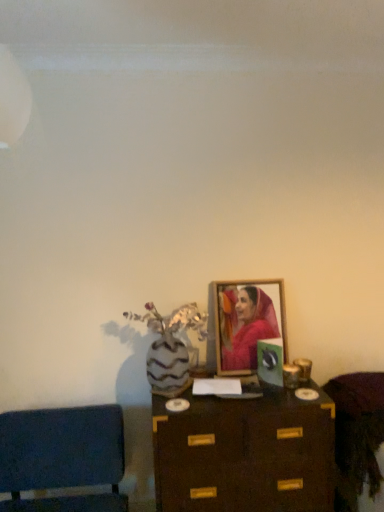
Question: Is wooden cabinet at lower right, the 2th furniture viewed from the left, in front of wooden framed portrait at center?

Choices:
 (A) no
 (B) yes

Answer: (B)

Question: Would you consider wooden cabinet at lower right, the 2th furniture viewed from the left, to be distant from wooden framed portrait at center?

Choices:
 (A) yes
 (B) no

Answer: (B)

Question: Considering the relative positions of wooden cabinet at lower right, the 2th furniture viewed from the left, and wooden framed portrait at center in the image provided, is wooden cabinet at lower right, the 2th furniture viewed from the left, to the left of wooden framed portrait at center from the viewer's perspective?

Choices:
 (A) yes
 (B) no

Answer: (B)

Question: Considering the relative sizes of wooden cabinet at lower right, the 2th furniture viewed from the left, and wooden framed portrait at center in the image provided, is wooden cabinet at lower right, the 2th furniture viewed from the left, taller than wooden framed portrait at center?

Choices:
 (A) yes
 (B) no

Answer: (B)

Question: From the image's perspective, is wooden cabinet at lower right, acting as the 1th furniture starting from the right, beneath wooden framed portrait at center?

Choices:
 (A) no
 (B) yes

Answer: (B)

Question: Is wooden cabinet at lower right, acting as the 1th furniture starting from the right, positioned with its back to wooden framed portrait at center?

Choices:
 (A) yes
 (B) no

Answer: (B)

Question: Does velvet blue cushion at lower left, placed as the 1th furniture when sorted from left to right, come behind wooden framed portrait at center?

Choices:
 (A) no
 (B) yes

Answer: (A)

Question: Is velvet blue cushion at lower left, placed as the 1th furniture when sorted from left to right, positioned with its back to wooden framed portrait at center?

Choices:
 (A) yes
 (B) no

Answer: (B)

Question: From the image's perspective, would you say velvet blue cushion at lower left, the 2th furniture in the right-to-left sequence, is positioned over wooden framed portrait at center?

Choices:
 (A) yes
 (B) no

Answer: (B)

Question: From the image's perspective, is velvet blue cushion at lower left, placed as the 1th furniture when sorted from left to right, below wooden framed portrait at center?

Choices:
 (A) no
 (B) yes

Answer: (B)

Question: Can we say velvet blue cushion at lower left, the 2th furniture in the right-to-left sequence, lies outside wooden framed portrait at center?

Choices:
 (A) no
 (B) yes

Answer: (B)

Question: Can you confirm if velvet blue cushion at lower left, the 2th furniture in the right-to-left sequence, is thinner than wooden framed portrait at center?

Choices:
 (A) no
 (B) yes

Answer: (A)

Question: From a real-world perspective, is wooden cabinet at lower right, the 2th furniture viewed from the left, on top of velvet blue cushion at lower left, placed as the 1th furniture when sorted from left to right?

Choices:
 (A) yes
 (B) no

Answer: (A)